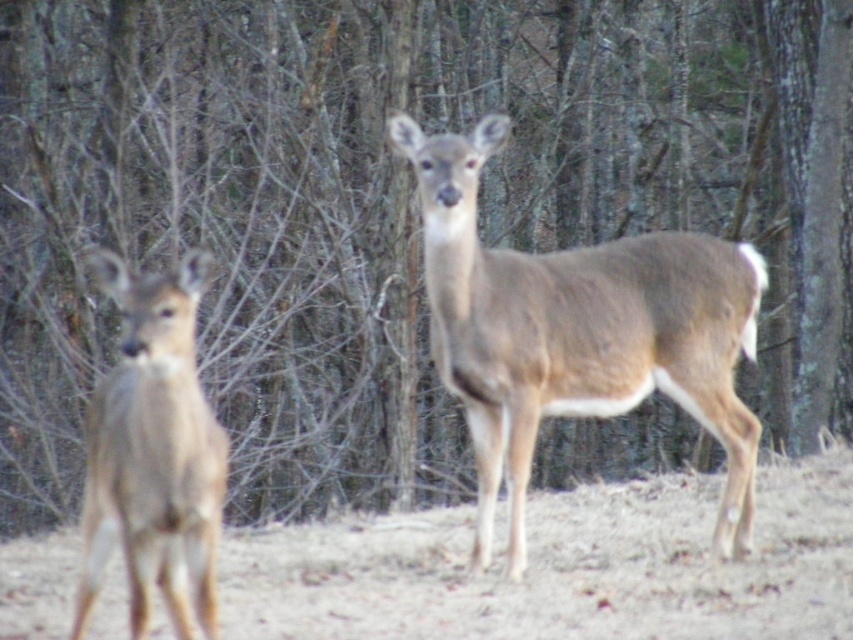
You are a hiker who has spotted two brown fur deer in the forest. You see the brown fur deer at center and the brown fur deer at left. Based on their positions, which deer is closer to you?

The brown fur deer at center is closer to you because it is positioned above the brown fur deer at left, indicating it is in a higher plane and thus nearer in the visual perspective.

You are an animal tracker analyzing the image. You notice a point at coordinates (578, 332). Based on the scene, what animal does this point likely belong to?

The point at coordinates (578, 332) corresponds to the brown fur deer at center.